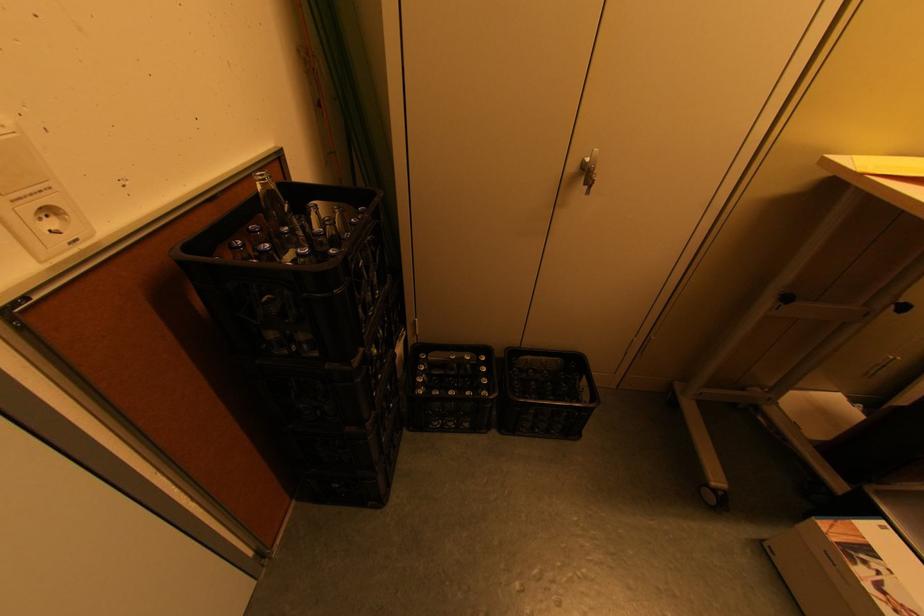
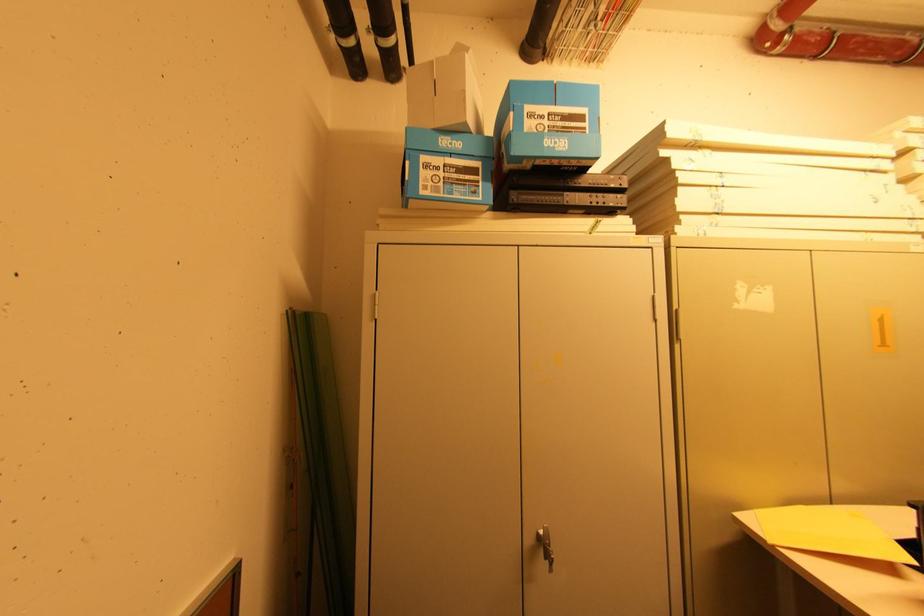
Question: The first image is from the beginning of the video and the second image is from the end. How did the camera likely rotate when shooting the video?

Choices:
 (A) Left
 (B) Right
 (C) Up
 (D) Down

Answer: (C)